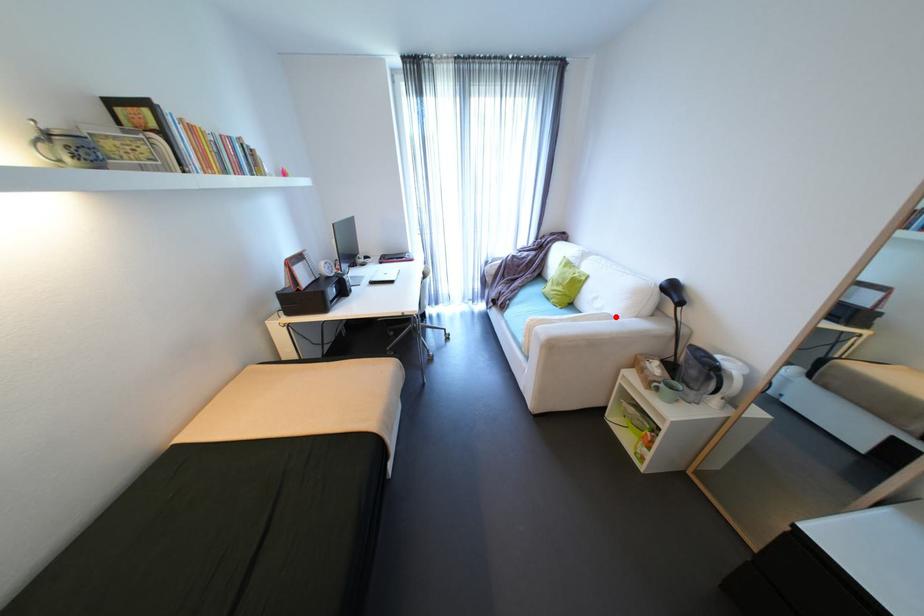
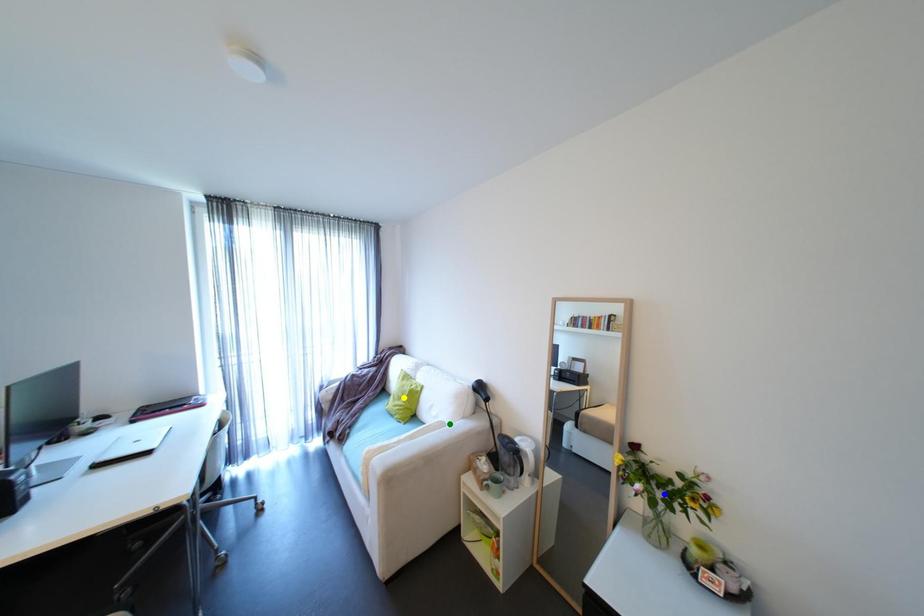
Question: I am providing you with two images of the same scene from different viewpoints. A red point is marked on the first image. You are given multiple points on the second image. Which point in image 2 represents the same 3d spot as the red point in image 1?

Choices:
 (A) green point
 (B) yellow point
 (C) blue point

Answer: (A)